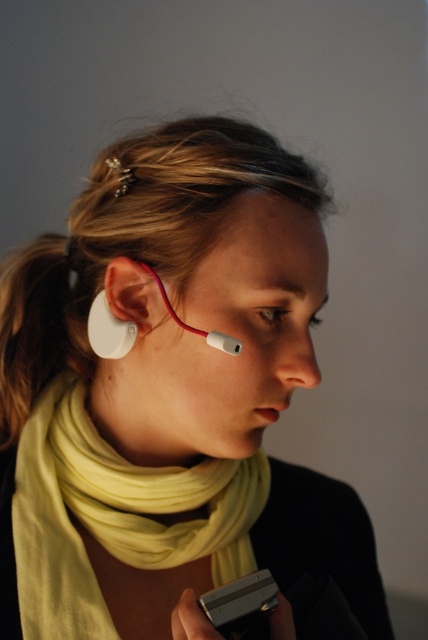
Question: Does yellow soft scarf at lower center appear under matte white earbud at left?

Choices:
 (A) yes
 (B) no

Answer: (A)

Question: Does white matte earbud at left have a greater width compared to white matte earbud at lower left?

Choices:
 (A) yes
 (B) no

Answer: (A)

Question: Which is farther from the white matte earbud at left?

Choices:
 (A) skinsmoothneck at center
 (B) white matte earbud at lower left
 (C) silver metallic smartphone at lower center

Answer: (C)

Question: From the image, what is the correct spatial relationship of skinsmoothneck at center in relation to matte white earbud at left?

Choices:
 (A) above
 (B) below

Answer: (B)

Question: Among these objects, which one is nearest to the camera?

Choices:
 (A) matte white earbud at left
 (B) silver metallic smartphone at lower center
 (C) white matte earbud at left

Answer: (B)

Question: Which of the following is the farthest from the observer?

Choices:
 (A) silver metallic smartphone at lower center
 (B) skinsmoothneck at center
 (C) white matte earbud at left

Answer: (C)